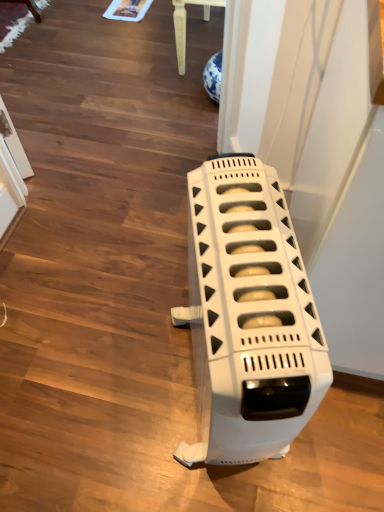
Identify the location of free space above white glossy radiator at center (from a real-world perspective). (250, 256).